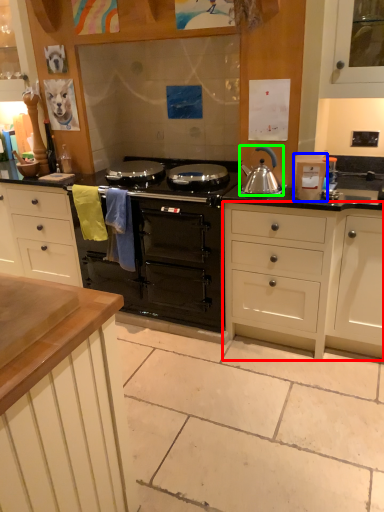
Question: Considering the real-world distances, which object is farthest from cabinetry (highlighted by a red box)? appliance (highlighted by a blue box) or kitchen appliance (highlighted by a green box)?

Choices:
 (A) appliance
 (B) kitchen appliance

Answer: (B)